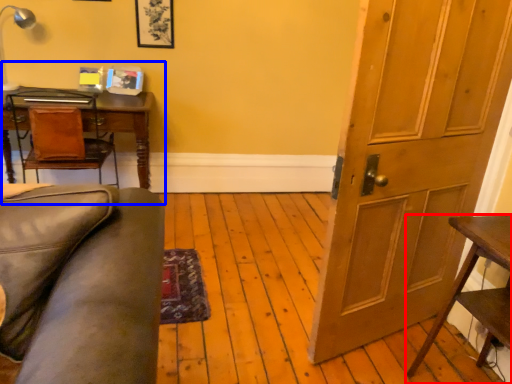
Question: Which of the following is the closest to the observer, table (highlighted by a red box) or computer desk (highlighted by a blue box)?

Choices:
 (A) table
 (B) computer desk

Answer: (A)